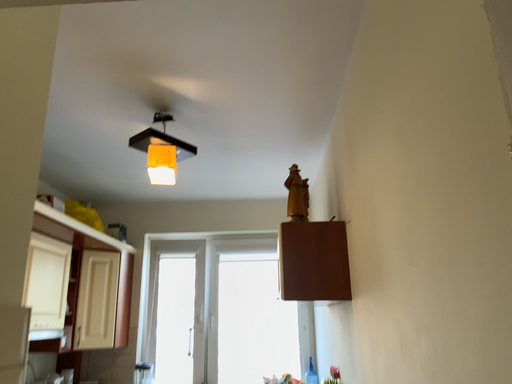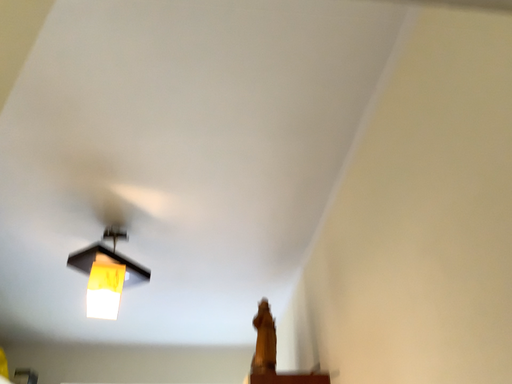
Question: Which way did the camera rotate in the video?

Choices:
 (A) rotated downward
 (B) rotated upward

Answer: (B)